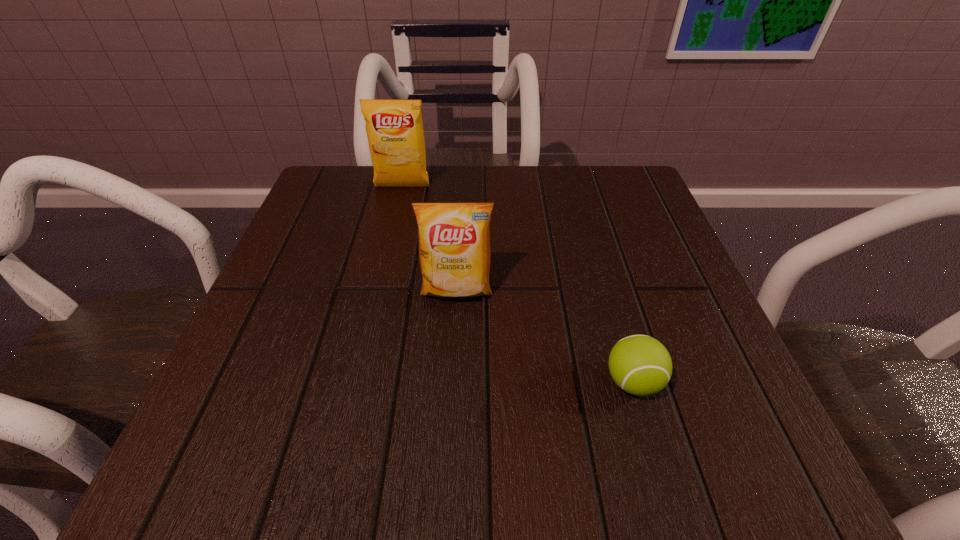
This screenshot has width=960, height=540. Identify the location of free region that satisfies the following two spatial constraints: 1. on the front-facing side of the nearest object; 2. on the left side of the second object from left to right. (451, 382).